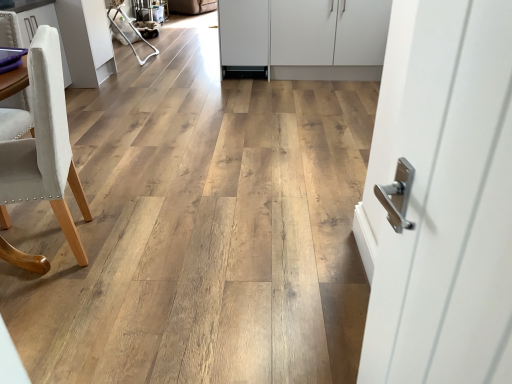
Question: Choose the correct answer: Is light beige fabric chair at left inside white matte cabinet at center, which ranks as the second cabinetry in left-to-right order, or outside it?

Choices:
 (A) inside
 (B) outside

Answer: (B)

Question: Relative to white matte cabinet at center, the first cabinetry in the right-to-left sequence, is light beige fabric chair at left in front or behind?

Choices:
 (A) behind
 (B) front

Answer: (B)

Question: Considering the real-world distances, which object is farthest from the white matte cabinet at center, the first cabinetry positioned from the back?

Choices:
 (A) light beige fabric chair at left
 (B) white fabric chair at left, positioned as the 2th cabinetry in right-to-left order
 (C) white fabric armchair at upper left

Answer: (A)

Question: Considering the real-world distances, which object is farthest from the light beige fabric chair at left?

Choices:
 (A) white matte cabinet at center, the first cabinetry in the right-to-left sequence
 (B) white fabric armchair at upper left
 (C) white fabric chair at left, acting as the 2th cabinetry starting from the back

Answer: (B)